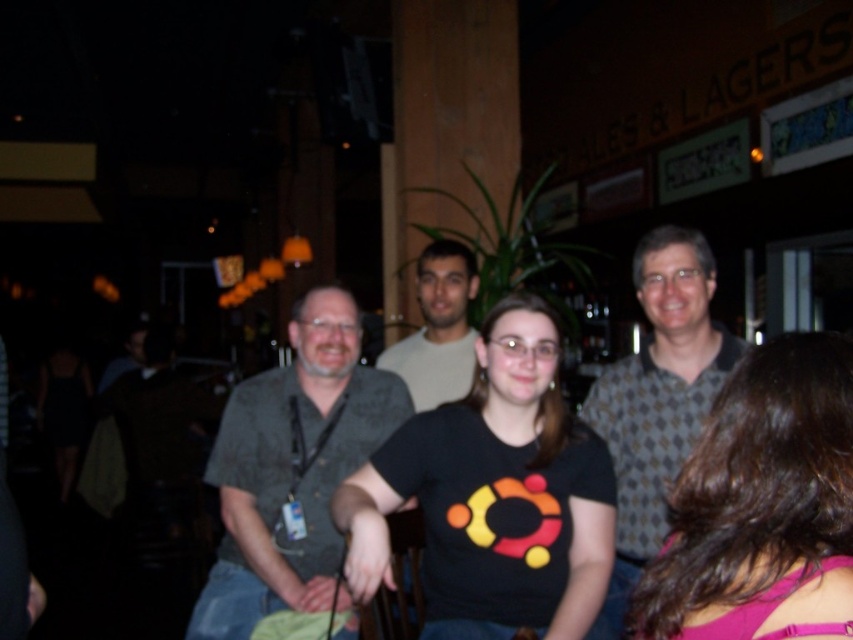
Question: Can you confirm if dark brown hair at center is smaller than light beige shirt at center?

Choices:
 (A) no
 (B) yes

Answer: (B)

Question: Which of the following is the farthest from the observer?

Choices:
 (A) dark green textured shirt at center
 (B) patterned fabric shirt at center

Answer: (A)

Question: From the image, what is the correct spatial relationship of dark brown hair at center in relation to dark green textured shirt at center?

Choices:
 (A) above
 (B) below

Answer: (B)

Question: Which object is farther from the camera taking this photo?

Choices:
 (A) dark green textured shirt at center
 (B) black matte t-shirt at center
 (C) dark brown hair at center
 (D) patterned fabric shirt at center

Answer: (A)

Question: Which of these objects is positioned farthest from the dark brown hair at center?

Choices:
 (A) light beige shirt at center
 (B) dark green textured shirt at center
 (C) black matte t-shirt at center

Answer: (A)

Question: Is dark brown hair at center positioned at the back of light beige shirt at center?

Choices:
 (A) yes
 (B) no

Answer: (B)